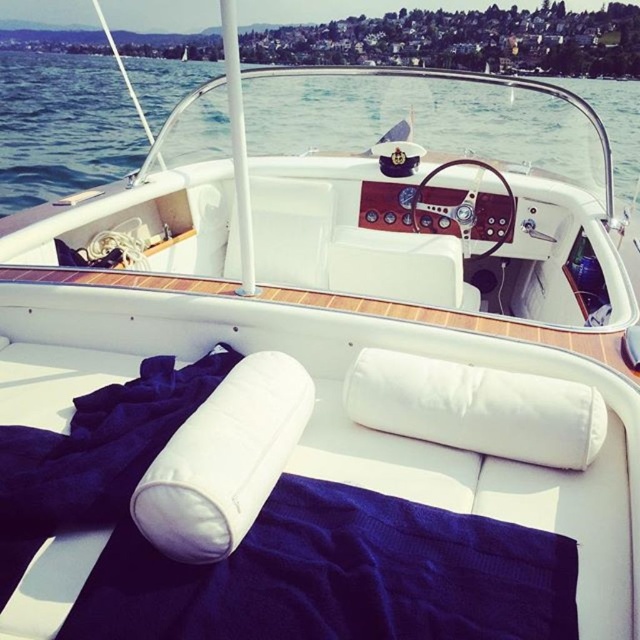
Question: Based on their relative distances, which object is farther from the transparent water at center?

Choices:
 (A) white soft pillow at center
 (B) white fabric pillow at center

Answer: (B)

Question: Where is transparent water at center located in relation to white soft pillow at center in the image?

Choices:
 (A) left
 (B) right

Answer: (B)

Question: Where is transparent water at center located in relation to white fabric pillow at center in the image?

Choices:
 (A) left
 (B) right

Answer: (B)

Question: Which object is closer to the camera taking this photo?

Choices:
 (A) transparent water at center
 (B) white fabric pillow at center
 (C) white soft pillow at center

Answer: (C)

Question: Estimate the real-world distances between objects in this image. Which object is farther from the white fabric pillow at center?

Choices:
 (A) white soft pillow at center
 (B) transparent water at center

Answer: (B)

Question: Is transparent water at center wider than white fabric pillow at center?

Choices:
 (A) yes
 (B) no

Answer: (A)